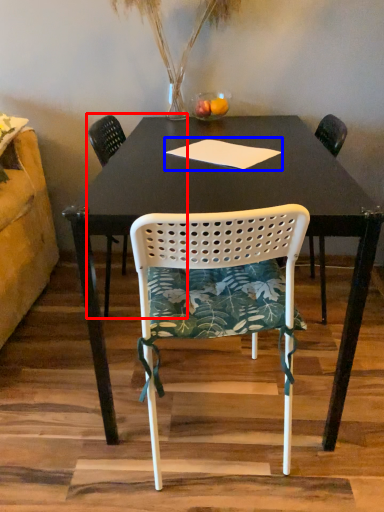
Question: Among these objects, which one is nearest to the camera, chair (highlighted by a red box) or notepad (highlighted by a blue box)?

Choices:
 (A) chair
 (B) notepad

Answer: (B)